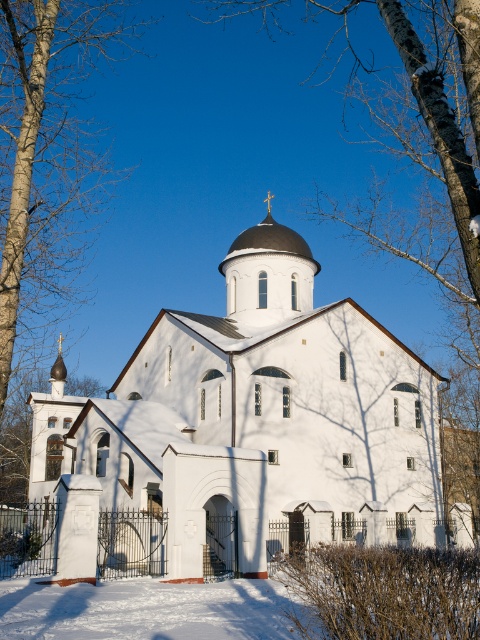
Between point (435, 531) and point (14, 209), which one is positioned behind?

The point (435, 531) is behind.

Does white smooth church at center lie in front of bare wood tree at left?

No.

Describe the element at coordinates (256, 419) in the screenshot. This screenshot has height=640, width=480. I see `white smooth church at center` at that location.

I want to click on white smooth church at center, so pos(256,419).